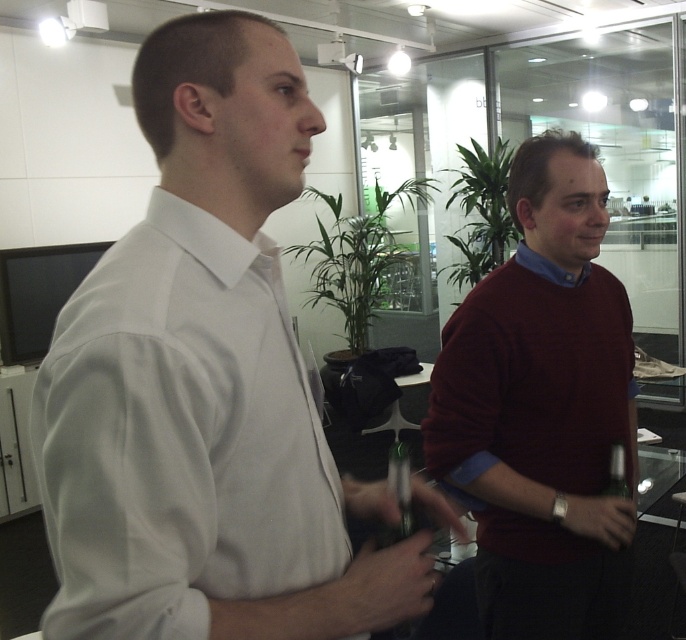
From the picture: You are standing in an office and see two points marked in the image. The first point is at coordinates point (272, 579) and the second is at point (567, 220). According to the scene description, which point is closer to you?

Point (272, 579) is in front of point (567, 220), so it is closer to you.

You are standing in the office scene described. There is a point at coordinates (204, 385). Which object from the scene is located at this point?

The point at coordinates (204, 385) corresponds to the white smooth shirt at center.

You are a tailor measuring two garments for alterations. You have the white smooth shirt at center and the maroon sweater at right in front of you. Which garment has a narrower width?

The white smooth shirt at center has a lesser width compared to maroon sweater at right, so the white smooth shirt at center is narrower in width.